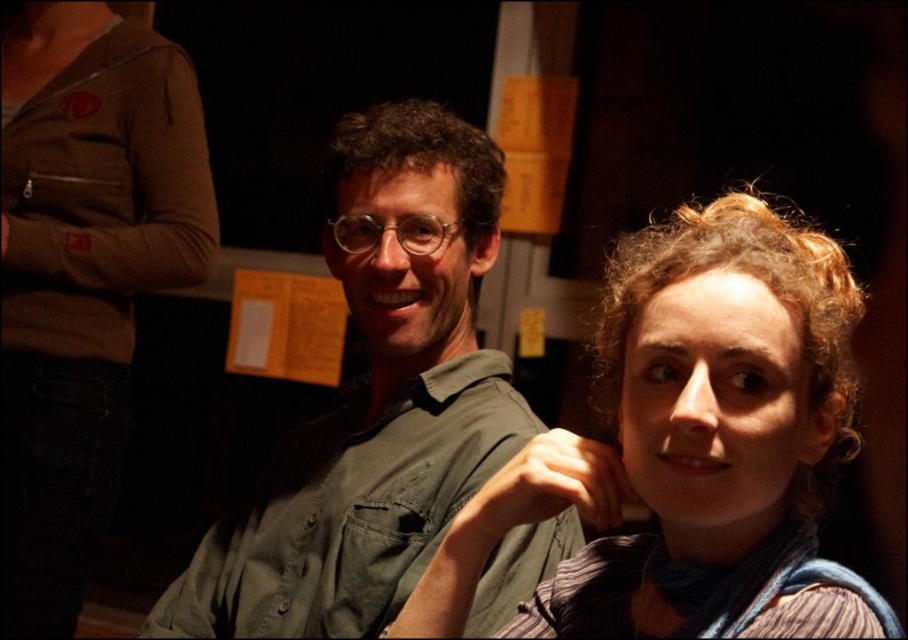
Question: Can you confirm if green matte shirt at center is smaller than curly hair at center?

Choices:
 (A) yes
 (B) no

Answer: (B)

Question: Among these objects, which one is farthest from the camera?

Choices:
 (A) brown zippered jacket at upper left
 (B) green matte shirt at center
 (C) curly hair at center

Answer: (A)

Question: Is green matte shirt at center to the right of curly hair at center from the viewer's perspective?

Choices:
 (A) yes
 (B) no

Answer: (B)

Question: Can you confirm if curly hair at center is positioned below brown zippered jacket at upper left?

Choices:
 (A) yes
 (B) no

Answer: (A)

Question: Which is nearer to the green matte shirt at center?

Choices:
 (A) brown zippered jacket at upper left
 (B) curly hair at center

Answer: (B)

Question: Which point is farther to the camera?

Choices:
 (A) (150, 202)
 (B) (788, 260)

Answer: (A)